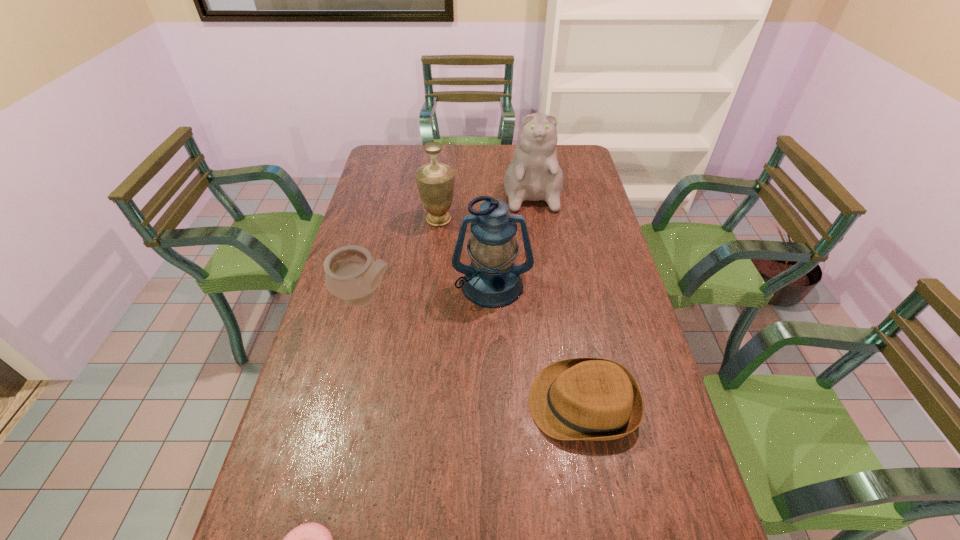
What are the coordinates of `vacant space located 0.070m on the front-facing side of the fedora` in the screenshot? It's located at (501, 403).

This screenshot has height=540, width=960. I want to click on vacant space situated 0.200m on the front-facing side of the fedora, so click(x=449, y=403).

Where is `blank area located 0.120m on the front-facing side of the fedora`? This screenshot has width=960, height=540. blank area located 0.120m on the front-facing side of the fedora is located at coordinates (481, 403).

Locate an element on the screen. Image resolution: width=960 pixels, height=540 pixels. object at the far edge is located at coordinates (534, 174).

Locate an element on the screen. object present at the left edge is located at coordinates (352, 274).

The width and height of the screenshot is (960, 540). I want to click on cat that is at the right edge, so click(534, 174).

Image resolution: width=960 pixels, height=540 pixels. What are the coordinates of `fedora present at the right edge` in the screenshot? It's located at (595, 399).

At what (x,y) coordinates should I click in order to perform the action: click on object located in the far right corner section of the desktop. Please return your answer as a coordinate pair (x, y). Looking at the image, I should click on (534, 174).

What are the coordinates of `free space at the far edge` in the screenshot? It's located at (447, 165).

Locate an element on the screen. This screenshot has height=540, width=960. vacant space at the left edge of the desktop is located at coordinates (278, 458).